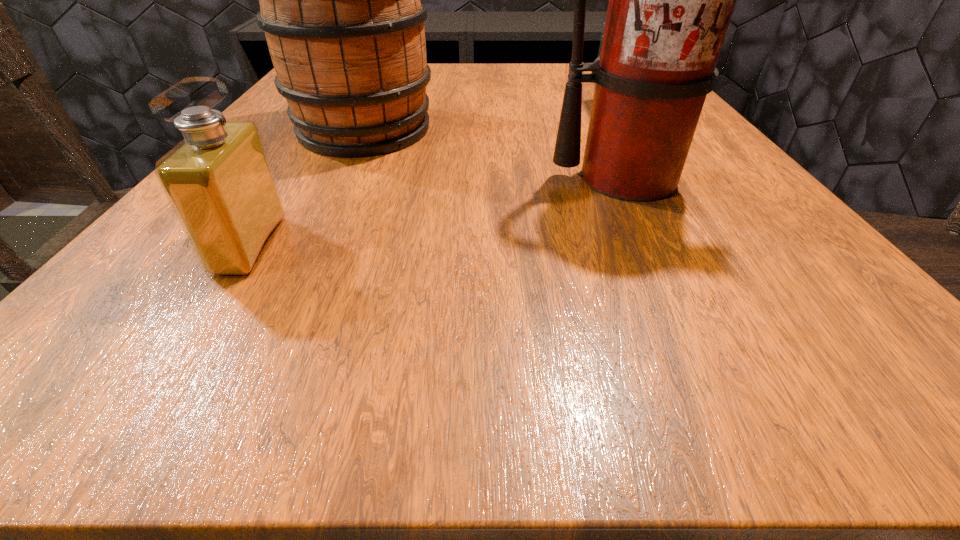
The image size is (960, 540). I want to click on free space between the cider and the farther perfume, so click(488, 119).

Image resolution: width=960 pixels, height=540 pixels. Identify the location of free point between the tallest object and the nearer perfume. (438, 212).

Locate an element on the screen. The width and height of the screenshot is (960, 540). vacant region between the right perfume and the left perfume is located at coordinates (431, 177).

You are a GUI agent. You are given a task and a screenshot of the screen. Output one action in this format:
    pyautogui.click(x=<x>, y=<y>)
    Task: Click on the empty space between the left perfume and the right perfume
    The height and width of the screenshot is (540, 960).
    Given the screenshot: What is the action you would take?
    pyautogui.click(x=431, y=177)

The height and width of the screenshot is (540, 960). I want to click on unoccupied position between the left perfume and the tallest object, so click(x=438, y=212).

The image size is (960, 540). What are the coordinates of `free space between the cider and the fire extinguisher` in the screenshot? It's located at (494, 154).

You are a GUI agent. You are given a task and a screenshot of the screen. Output one action in this format:
    pyautogui.click(x=<x>, y=<y>)
    Task: Click on the vacant space that is in between the fire extinguisher and the third shortest object
    
    Given the screenshot: What is the action you would take?
    pyautogui.click(x=494, y=154)

Choose which object is the nearest neighbor to the cider. Please provide its 2D coordinates. Your answer should be formatted as a tuple, i.e. [(x, y)], where the tuple contains the x and y coordinates of a point satisfying the conditions above.

[(218, 180)]

Locate an element on the screen. object that is the second closest to the left perfume is located at coordinates (671, 0).

The image size is (960, 540). Find the location of `vacant space that satisfies the following two spatial constraints: 1. on the front label of the farther perfume; 2. toward the nozzle of the tallest object`. vacant space that satisfies the following two spatial constraints: 1. on the front label of the farther perfume; 2. toward the nozzle of the tallest object is located at coordinates (654, 178).